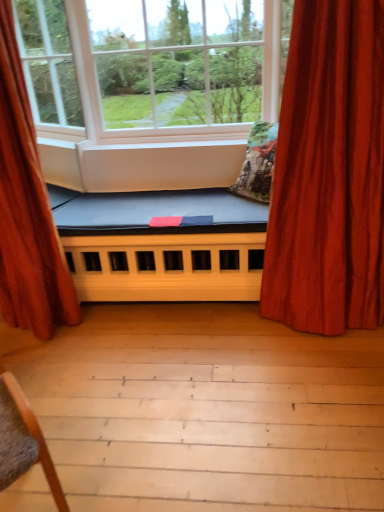
Image resolution: width=384 pixels, height=512 pixels. I want to click on free space in front of textured floral pillow at center, so click(x=236, y=209).